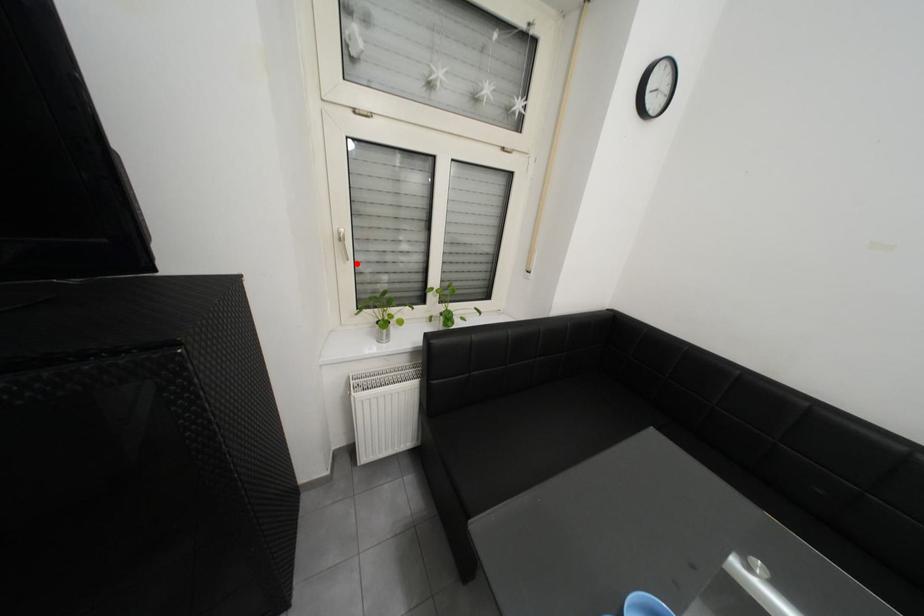
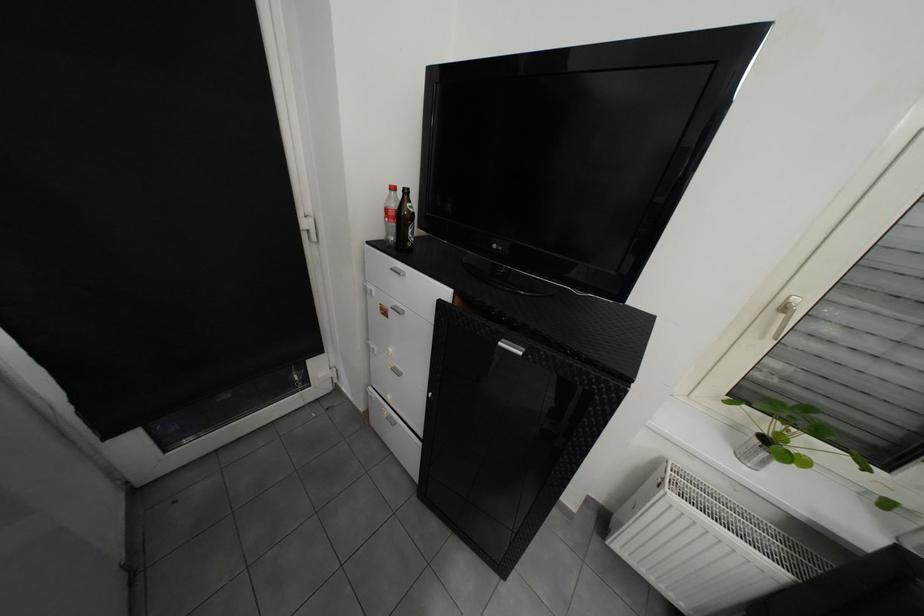
Question: I am providing you with two images of the same scene from different viewpoints. Image1 has a red point marked. In image2, the corresponding 3D location appears at what relative position? Reply with the corresponding letter.

Choices:
 (A) Closer
 (B) Farther

Answer: (B)